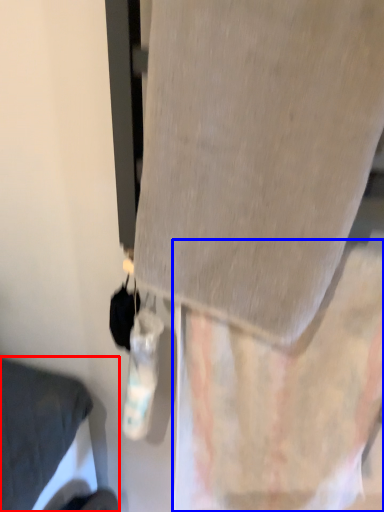
Question: Which object appears farthest to the camera in this image, furniture (highlighted by a red box) or curtain (highlighted by a blue box)?

Choices:
 (A) furniture
 (B) curtain

Answer: (A)